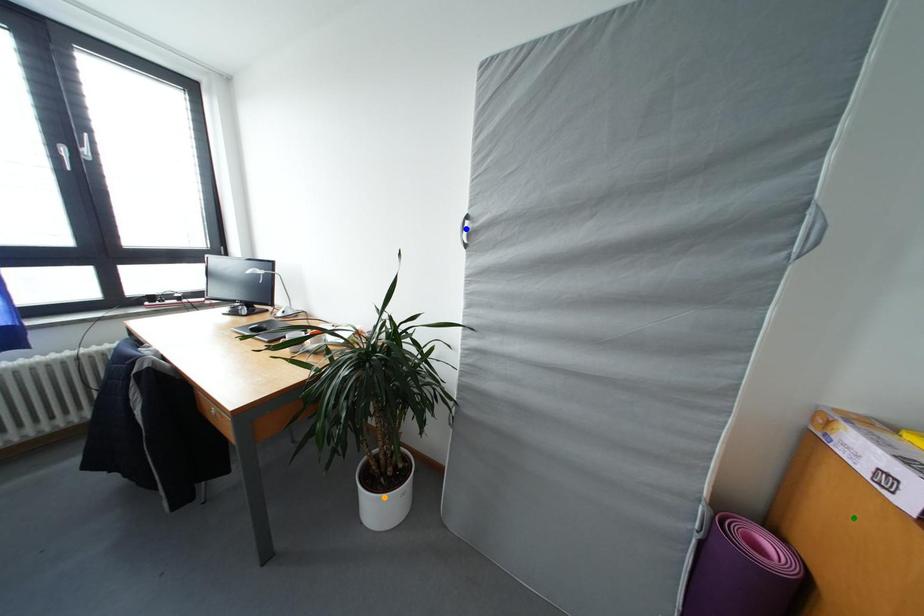
Order these from nearest to farthest:
orange point, blue point, green point

orange point → blue point → green point